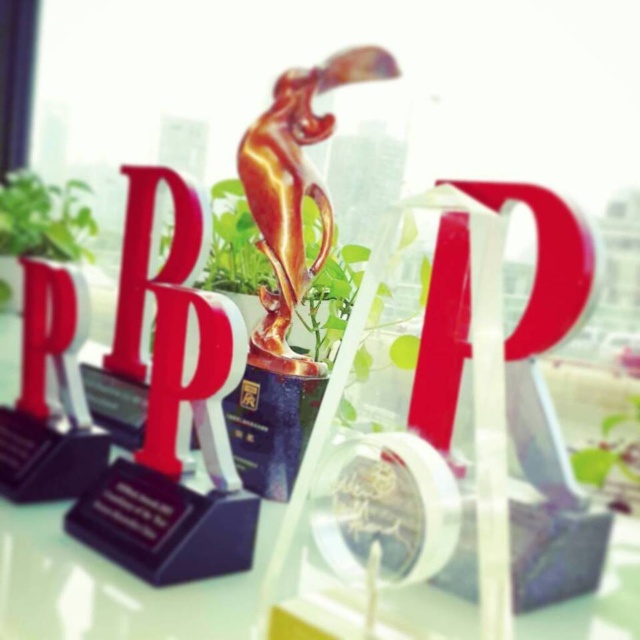
Can you confirm if matte plastic letter p at center right is taller than green leafy plant at upper left?

Incorrect, matte plastic letter p at center right's height is not larger of green leafy plant at upper left's.

Who is more distant from viewer, (x=467, y=316) or (x=60, y=230)?

Point (x=60, y=230)

Is point (556, 280) closer to viewer compared to point (10, 289)?

Yes, it is.

This screenshot has height=640, width=640. I want to click on matte plastic letter p at center right, so click(545, 262).

Does matte plastic letter p at center right have a smaller size compared to green leafy plant at center?

No.

From the picture: Is matte plastic letter p at center right in front of green leafy plant at center?

Yes, it is in front of green leafy plant at center.

This screenshot has height=640, width=640. Describe the element at coordinates (545, 262) in the screenshot. I see `matte plastic letter p at center right` at that location.

Where is `matte plastic letter p at center right`? This screenshot has height=640, width=640. matte plastic letter p at center right is located at coordinates (545, 262).

Between point (186, 186) and point (92, 228), which one is positioned in front?

Point (186, 186)

Can you confirm if red plastic letter b at center is positioned to the right of green leafy plant at upper left?

Yes, red plastic letter b at center is to the right of green leafy plant at upper left.

I want to click on red plastic letter b at center, so click(148, 257).

The height and width of the screenshot is (640, 640). Find the location of `red plastic letter b at center`. red plastic letter b at center is located at coordinates (148, 257).